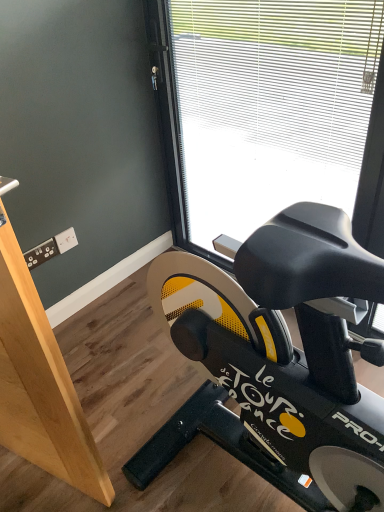
Question: Looking at the image, does transparent glass window at center seem bigger or smaller compared to black matte stationary bicycle at lower right?

Choices:
 (A) small
 (B) big

Answer: (B)

Question: From the image's perspective, relative to black matte stationary bicycle at lower right, is transparent glass window at center above or below?

Choices:
 (A) above
 (B) below

Answer: (A)

Question: Which is nearer to the black matte stationary bicycle at lower right?

Choices:
 (A) light brown wood at left
 (B) transparent glass window at center

Answer: (A)

Question: Which is farther from the light brown wood at left?

Choices:
 (A) transparent glass window at center
 (B) black matte stationary bicycle at lower right

Answer: (A)